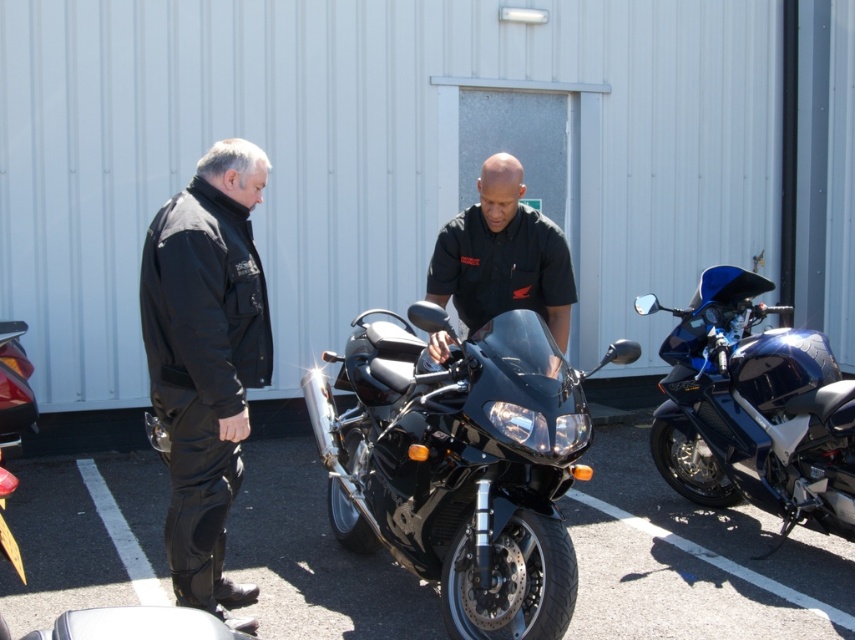
Question: Does black metallic motorcycle at center have a lesser width compared to glossy blue motorcycle at right?

Choices:
 (A) yes
 (B) no

Answer: (B)

Question: From the image, what is the correct spatial relationship of black leather pants at left in relation to black smooth shirt at center?

Choices:
 (A) below
 (B) above

Answer: (A)

Question: Which is nearer to the glossy blue motorcycle at right?

Choices:
 (A) black leather pants at left
 (B) black metallic motorcycle at center
 (C) black smooth shirt at center

Answer: (C)

Question: Which is nearer to the glossy blue motorcycle at right?

Choices:
 (A) black leather pants at left
 (B) black metallic motorcycle at center
 (C) black smooth shirt at center

Answer: (C)

Question: Can you confirm if black leather pants at left is positioned above black smooth shirt at center?

Choices:
 (A) no
 (B) yes

Answer: (A)

Question: Among these objects, which one is farthest from the camera?

Choices:
 (A) glossy blue motorcycle at right
 (B) black metallic motorcycle at center

Answer: (A)